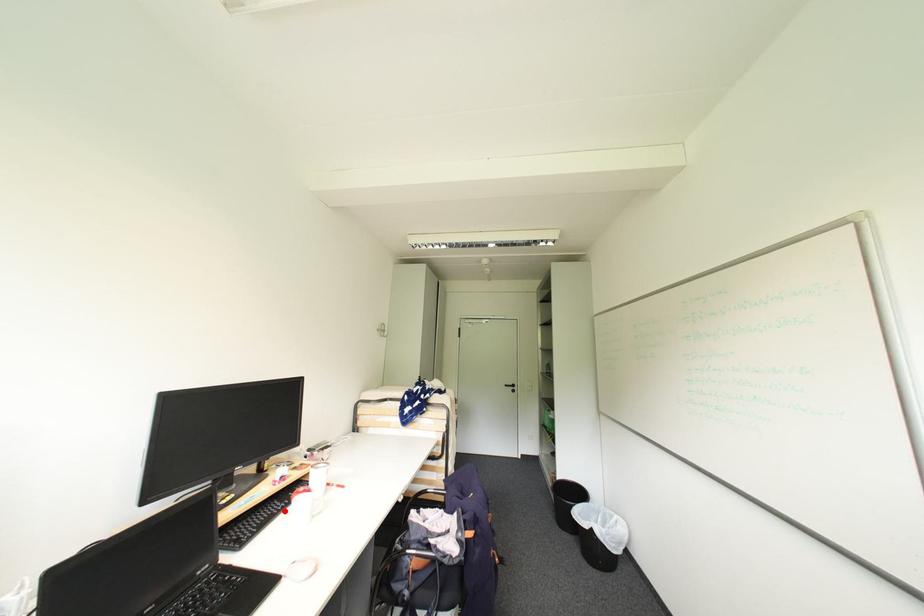
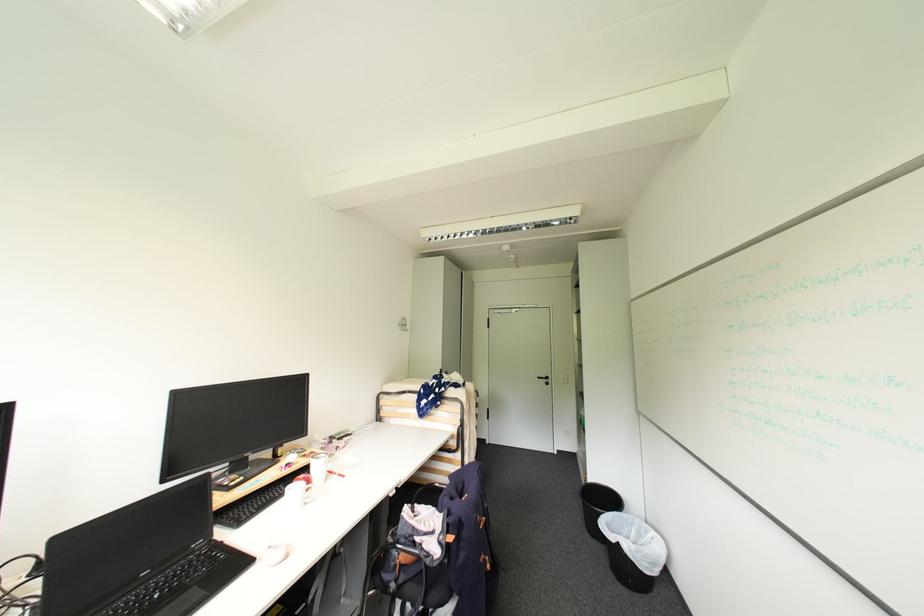
In the second image, find the point that corresponds to the highlighted location in the first image.

(286, 495)